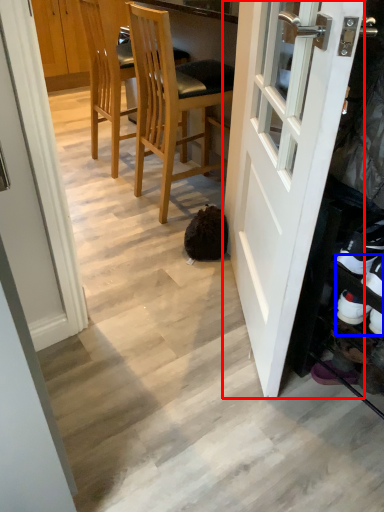
Question: Which object is further to the camera taking this photo, door (highlighted by a red box) or shoe (highlighted by a blue box)?

Choices:
 (A) door
 (B) shoe

Answer: (B)